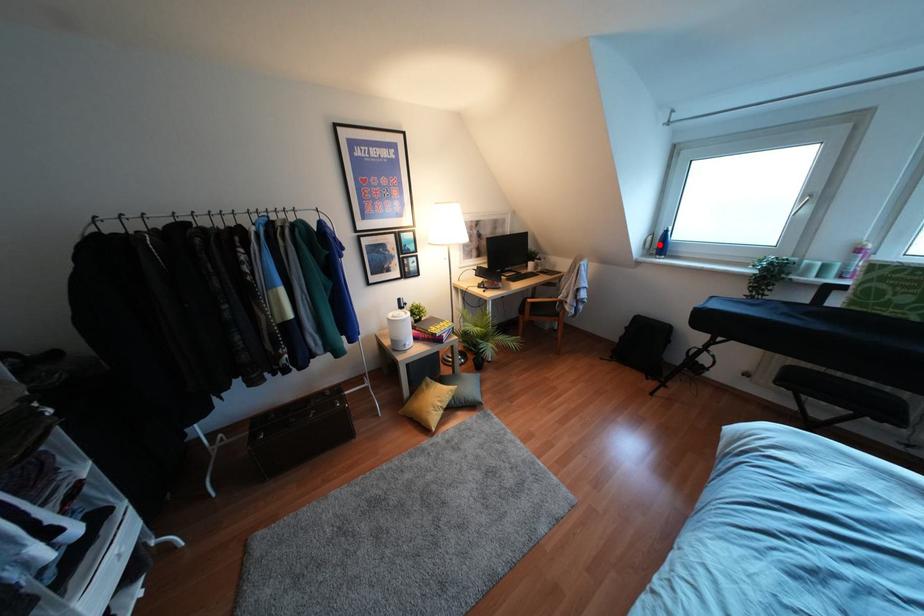
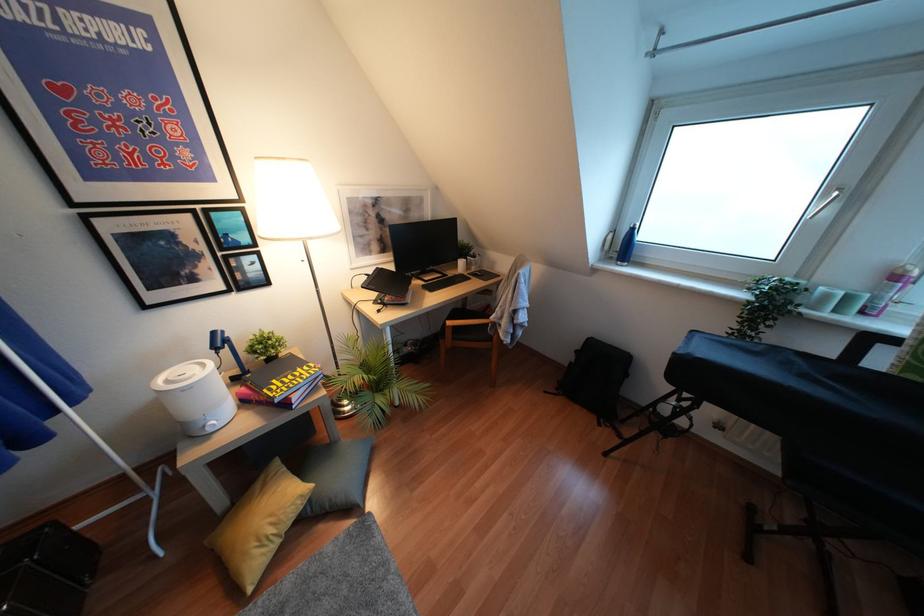
Where in the second image is the point corresponding to the highlighted location from the first image?

(623, 246)